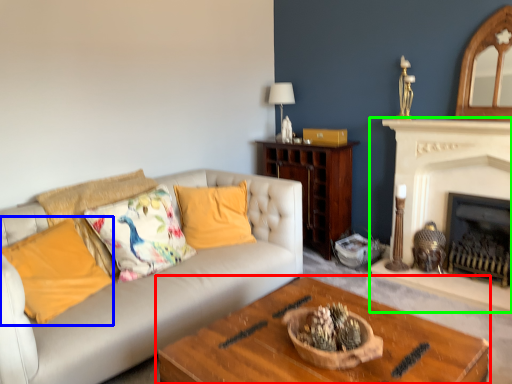
Question: Considering the real-world distances, which object is farthest from coffee table (highlighted by a red box)? pillow (highlighted by a blue box) or fireplace (highlighted by a green box)?

Choices:
 (A) pillow
 (B) fireplace

Answer: (B)